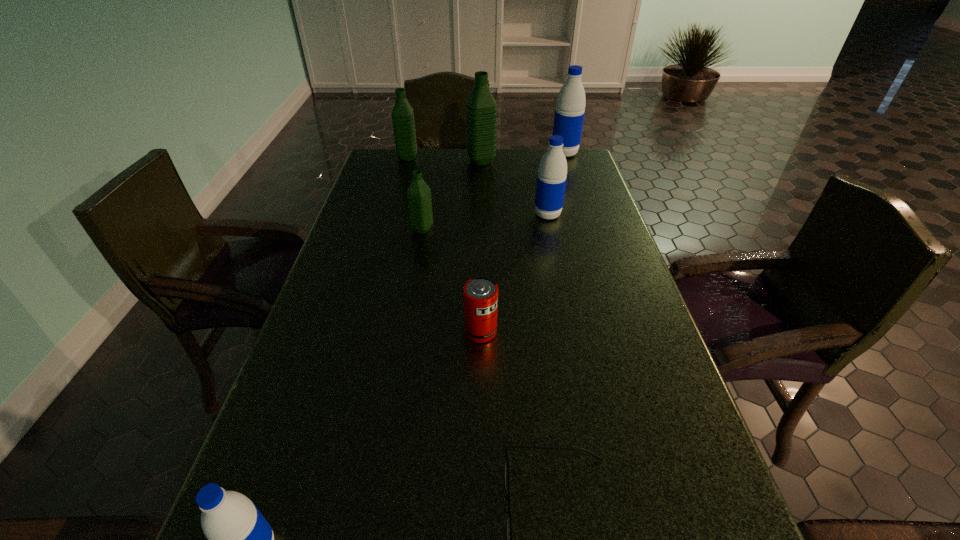
The width and height of the screenshot is (960, 540). I want to click on the rightmost object, so click(570, 107).

Find the location of a particular element. Image resolution: width=960 pixels, height=540 pixels. the rightmost blue water bottle is located at coordinates (570, 107).

The height and width of the screenshot is (540, 960). In order to click on the rightmost green water bottle in this screenshot , I will do `click(481, 109)`.

Locate an element on the screen. the biggest green water bottle is located at coordinates (481, 109).

You are a GUI agent. You are given a task and a screenshot of the screen. Output one action in this format:
    pyautogui.click(x=<x>, y=<y>)
    Task: Click on the second biggest green water bottle
    Image resolution: width=960 pixels, height=540 pixels.
    Given the screenshot: What is the action you would take?
    pyautogui.click(x=403, y=121)

Where is `the second biggest blue water bottle`? Image resolution: width=960 pixels, height=540 pixels. the second biggest blue water bottle is located at coordinates (552, 174).

Where is `the fourth farthest water bottle`? the fourth farthest water bottle is located at coordinates (552, 174).

Find the location of a particular element. The height and width of the screenshot is (540, 960). the smallest green water bottle is located at coordinates (418, 195).

Find the location of a particular element. The width and height of the screenshot is (960, 540). the nearest green water bottle is located at coordinates (418, 195).

Identify the location of the seventh tallest object. (480, 294).